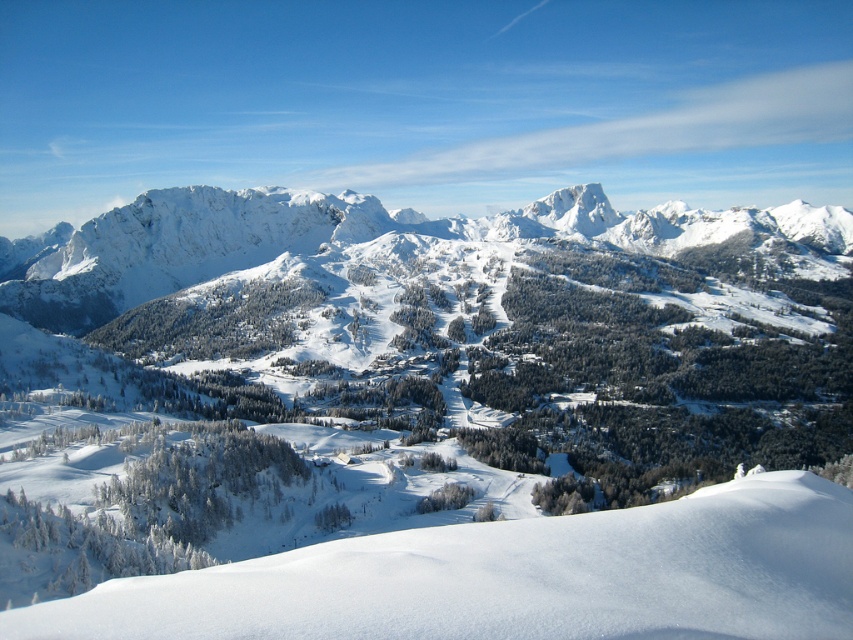
Question: Which point is closer to the camera?

Choices:
 (A) white snow ski slope at lower left
 (B) white snow-covered mountain range at center

Answer: (A)

Question: Among these points, which one is farthest from the camera?

Choices:
 (A) (838, 509)
 (B) (653, 232)

Answer: (B)

Question: Where is white snow ski slope at lower left located in relation to white snow-covered mountain range at center in the image?

Choices:
 (A) below
 (B) above

Answer: (A)

Question: Is white snow ski slope at lower left bigger than white snow-covered mountain range at center?

Choices:
 (A) yes
 (B) no

Answer: (B)

Question: Among these objects, which one is nearest to the camera?

Choices:
 (A) white snow ski slope at lower left
 (B) white snow-covered mountain range at center

Answer: (A)

Question: Is white snow ski slope at lower left closer to camera compared to white snow-covered mountain range at center?

Choices:
 (A) yes
 (B) no

Answer: (A)